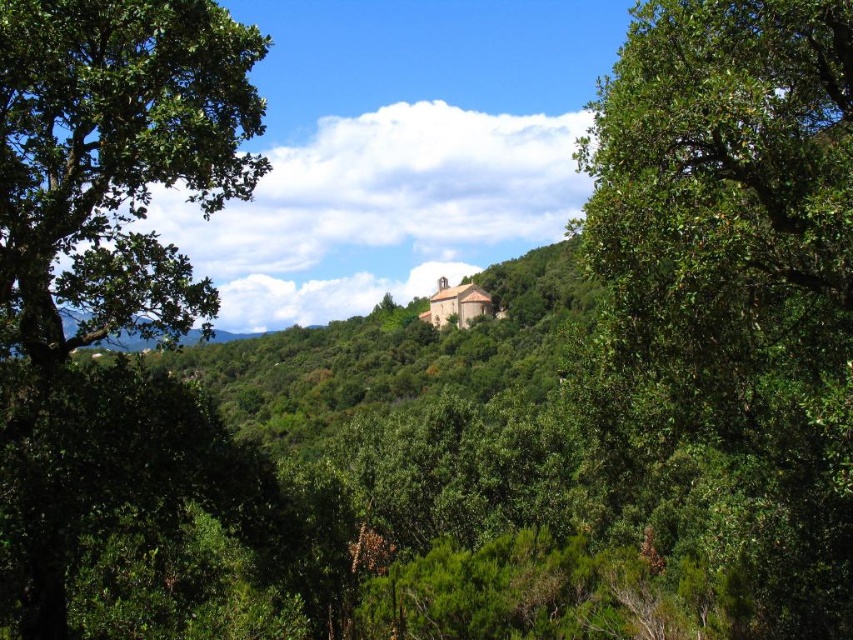
Based on the scene description, where is the green leafy tree at center located in terms of coordinates?

The green leafy tree at center is located at coordinates point (740, 264).

You are a hiker who wants to take a photo of both the green leafy tree at center and the green leafy tree at left. Which tree should you stand closer to in order to capture both in the same frame?

To capture both the green leafy tree at center and the green leafy tree at left in the same frame, you should stand closer to the green leafy tree at left since it is shorter than the green leafy tree at center. This allows the taller tree to fit within the camera view without being cut off while including the shorter one.

You are standing in the middle of the forest looking towards the hill. You see a green leafy tree at center and a green leafy tree at left. Which tree is positioned to the right of the other?

The green leafy tree at center is to the right of the green leafy tree at left.